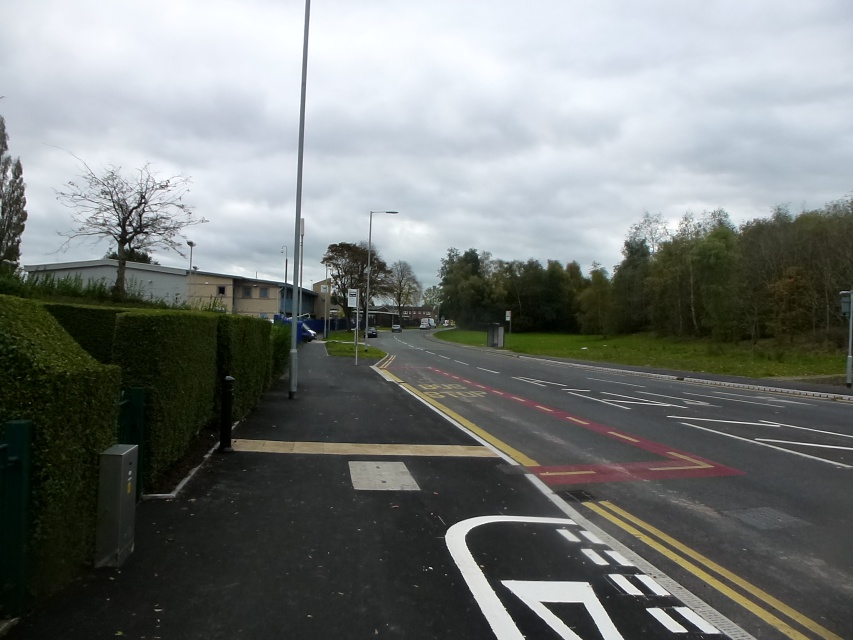
Is point (55, 355) less distant than point (688, 276)?

Yes, it is in front of point (688, 276).

Is green leafy hedge at left further to the viewer compared to green leafy hedge at center?

That is False.

Is point (35, 388) farther from viewer compared to point (564, 307)?

That is False.

The width and height of the screenshot is (853, 640). I want to click on green leafy hedge at left, so click(x=114, y=403).

Can you confirm if green leafy hedge at left is positioned to the right of white plastic sign at center?

Correct, you'll find green leafy hedge at left to the right of white plastic sign at center.

Between point (229, 324) and point (347, 301), which one is positioned behind?

The point (347, 301) is behind.

Find the location of `green leafy hedge at left`. green leafy hedge at left is located at coordinates (114, 403).

Find the location of a particular element. This screenshot has height=640, width=853. green leafy hedge at left is located at coordinates (114, 403).

Based on the photo, which is below, green leafy hedge at center or white plastic sign at center?

Positioned lower is white plastic sign at center.

Find the location of `green leafy hedge at center`. green leafy hedge at center is located at coordinates (672, 280).